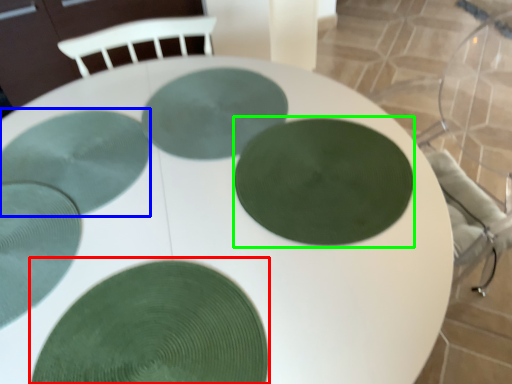
Question: Estimate the real-world distances between objects in this image. Which object is farther from glass plate (highlighted by a red box), glass plate (highlighted by a blue box) or glass plate (highlighted by a green box)?

Choices:
 (A) glass plate
 (B) glass plate

Answer: (A)